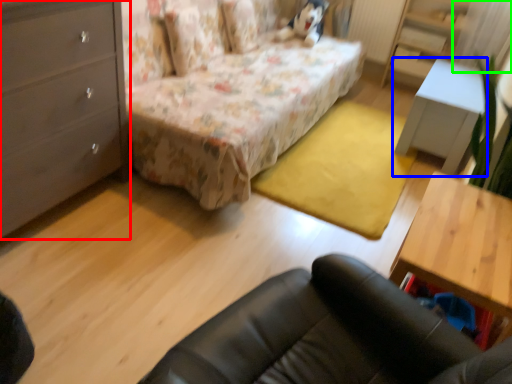
Question: Which object is the closest to the chest of drawers (highlighted by a red box)? Choose among these: table (highlighted by a blue box) or curtain (highlighted by a green box).

Choices:
 (A) table
 (B) curtain

Answer: (A)